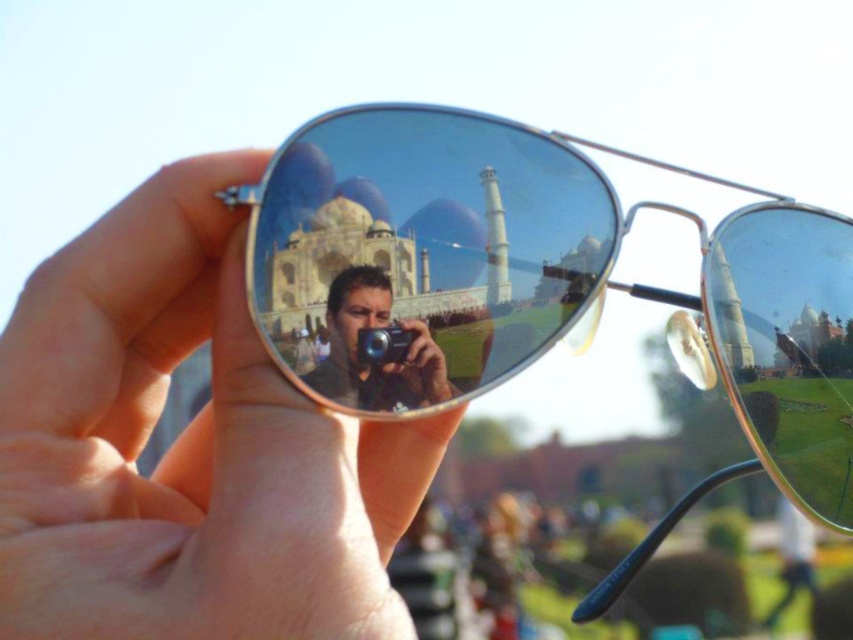
Is gold reflective sunglasses at center further to the viewer compared to matte black camera at center?

No.

Is point (434, 342) farther from camera compared to point (399, 388)?

That is True.

Who is more distant from viewer, (838, 403) or (369, 378)?

The point (838, 403) is behind.

In order to click on gold reflective sunglasses at center in this screenshot , I will do `click(537, 285)`.

Does smooth skin hand at center have a lesser height compared to matte black camera at center?

In fact, smooth skin hand at center may be taller than matte black camera at center.

Which is below, smooth skin hand at center or matte black camera at center?

smooth skin hand at center

What do you see at coordinates (186, 445) in the screenshot?
I see `smooth skin hand at center` at bounding box center [186, 445].

You are a GUI agent. You are given a task and a screenshot of the screen. Output one action in this format:
    pyautogui.click(x=<x>, y=<y>)
    Task: Click on the smooth skin hand at center
    Image resolution: width=853 pixels, height=640 pixels.
    Given the screenshot: What is the action you would take?
    pyautogui.click(x=186, y=445)

Does smooth skin hand at center appear under gold reflective sunglasses at center?

Yes.

Locate an element on the screen. The width and height of the screenshot is (853, 640). smooth skin hand at center is located at coordinates (186, 445).